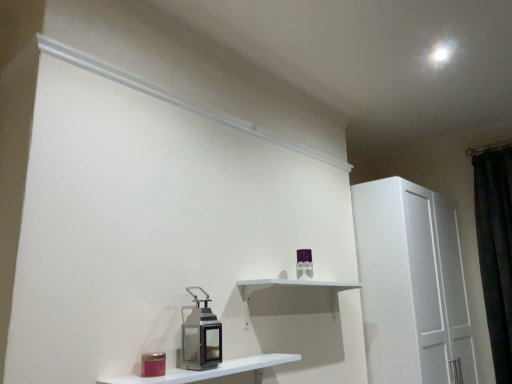
Question: Should I look upward or downward to see dark velvet curtain at right?

Choices:
 (A) down
 (B) up

Answer: (A)

Question: Does white matte shelf at center, which is the second shelf in front-to-back order, have a lesser width compared to white glossy shelf at lower center, which ranks as the 2th shelf in back-to-front order?

Choices:
 (A) yes
 (B) no

Answer: (A)

Question: From the image's perspective, does white matte shelf at center, which is the second shelf in front-to-back order, appear lower than white glossy shelf at lower center, the first shelf in the front-to-back sequence?

Choices:
 (A) no
 (B) yes

Answer: (A)

Question: Is white matte shelf at center, which is the second shelf in front-to-back order, not within white glossy shelf at lower center, which ranks as the 2th shelf in back-to-front order?

Choices:
 (A) no
 (B) yes

Answer: (B)

Question: From a real-world perspective, is white matte shelf at center, which is the second shelf in front-to-back order, physically below white glossy shelf at lower center, which ranks as the 2th shelf in back-to-front order?

Choices:
 (A) yes
 (B) no

Answer: (B)

Question: Can you confirm if white matte shelf at center, which is counted as the first shelf, starting from the back, is smaller than white glossy shelf at lower center, which ranks as the 2th shelf in back-to-front order?

Choices:
 (A) no
 (B) yes

Answer: (A)

Question: Would you say white matte shelf at center, which is the second shelf in front-to-back order, is a long distance from white glossy shelf at lower center, the first shelf in the front-to-back sequence?

Choices:
 (A) yes
 (B) no

Answer: (B)

Question: Is white glossy shelf at lower center, which ranks as the 2th shelf in back-to-front order, turned away from dark velvet curtain at right?

Choices:
 (A) no
 (B) yes

Answer: (A)

Question: Considering the relative positions of white glossy shelf at lower center, which ranks as the 2th shelf in back-to-front order, and dark velvet curtain at right in the image provided, is white glossy shelf at lower center, which ranks as the 2th shelf in back-to-front order, to the right of dark velvet curtain at right from the viewer's perspective?

Choices:
 (A) yes
 (B) no

Answer: (B)

Question: Is white glossy shelf at lower center, the first shelf in the front-to-back sequence, with dark velvet curtain at right?

Choices:
 (A) no
 (B) yes

Answer: (A)

Question: Is white glossy shelf at lower center, which ranks as the 2th shelf in back-to-front order, bigger than dark velvet curtain at right?

Choices:
 (A) no
 (B) yes

Answer: (A)

Question: Is dark velvet curtain at right a part of white glossy shelf at lower center, which ranks as the 2th shelf in back-to-front order?

Choices:
 (A) yes
 (B) no

Answer: (B)

Question: From the image's perspective, is white glossy shelf at lower center, which ranks as the 2th shelf in back-to-front order, located beneath dark velvet curtain at right?

Choices:
 (A) yes
 (B) no

Answer: (A)

Question: From the image's perspective, would you say white glossy shelf at lower center, the first shelf in the front-to-back sequence, is shown under metallic lantern at center?

Choices:
 (A) yes
 (B) no

Answer: (A)